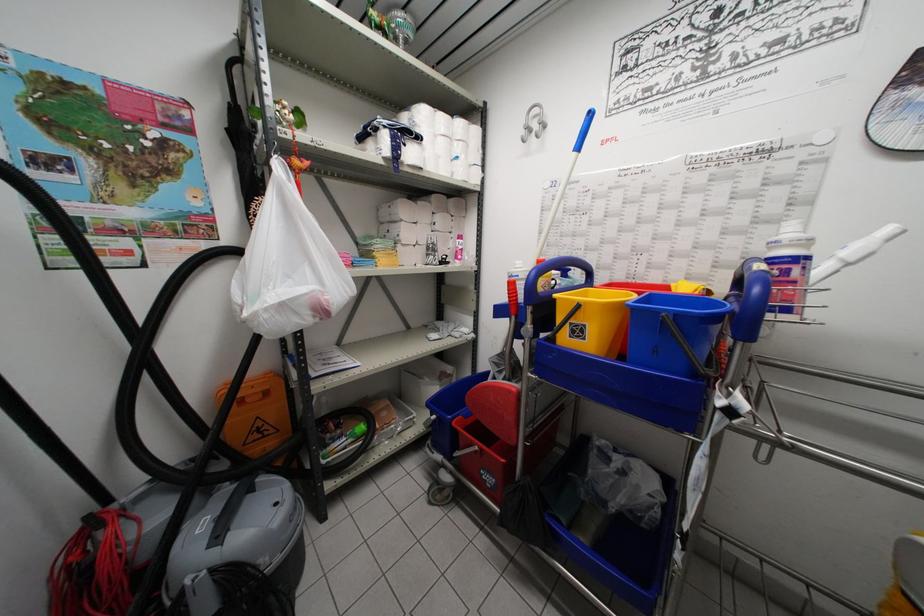
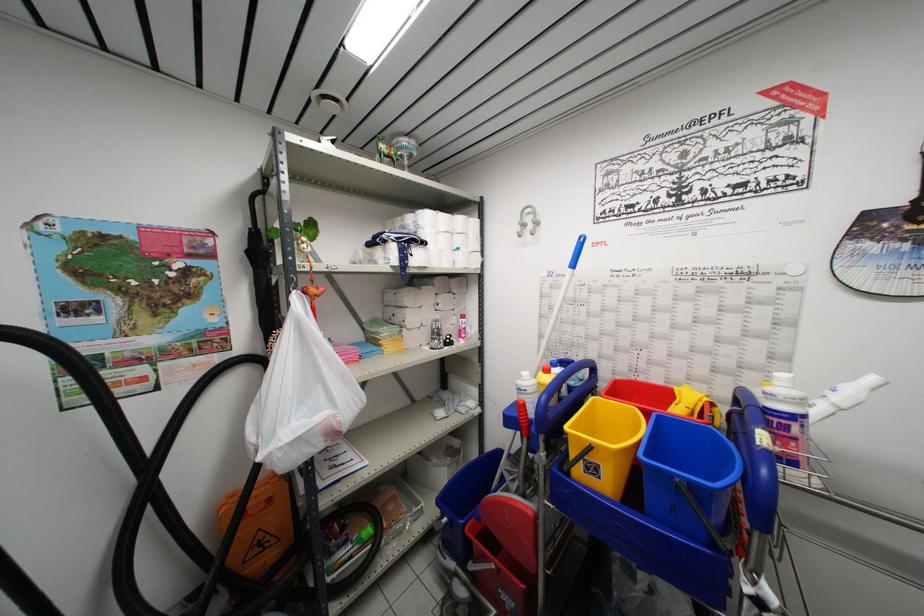
Locate, in the second image, the point that corresponds to point (516, 299) in the first image.

(526, 421)